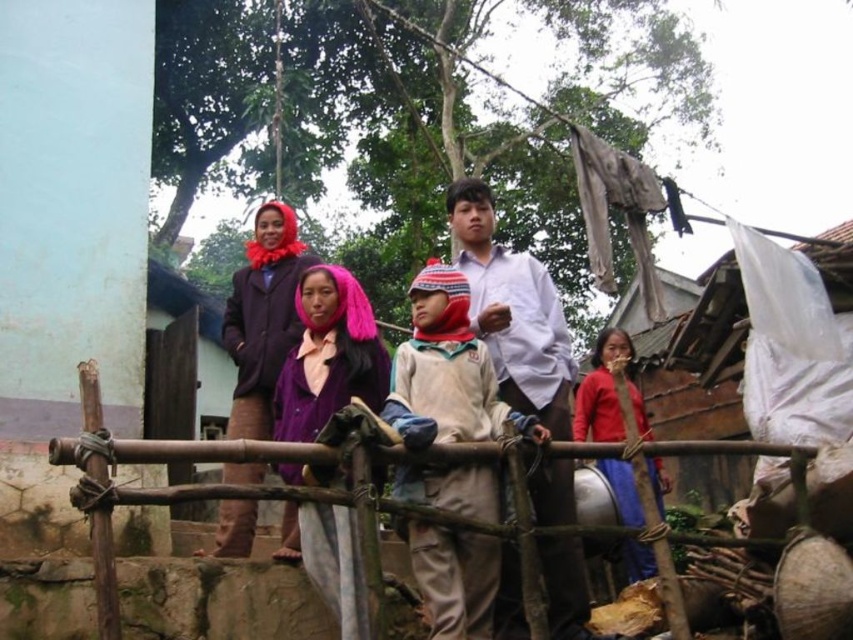
Question: Is purple woolen scarf at center to the left of red matte jacket at center from the viewer's perspective?

Choices:
 (A) no
 (B) yes

Answer: (B)

Question: Which is farther from the purple fabric headscarf at center?

Choices:
 (A) knitted woolen hat at center
 (B) brown wooden rail at center
 (C) matte purple dress at center
 (D) red matte jacket at center

Answer: (C)

Question: From the image, what is the correct spatial relationship of purple fabric headscarf at center in relation to red matte jacket at center?

Choices:
 (A) left
 (B) right

Answer: (A)

Question: Which point appears farthest from the camera in this image?

Choices:
 (A) (604, 358)
 (B) (550, 554)
 (C) (170, 493)

Answer: (A)

Question: Which object is positioned closest to the knitted woolen hat at center?

Choices:
 (A) red matte jacket at center
 (B) brown wooden rail at center

Answer: (B)

Question: Can you confirm if knitted woolen hat at center is positioned to the right of purple woolen scarf at center?

Choices:
 (A) no
 (B) yes

Answer: (B)